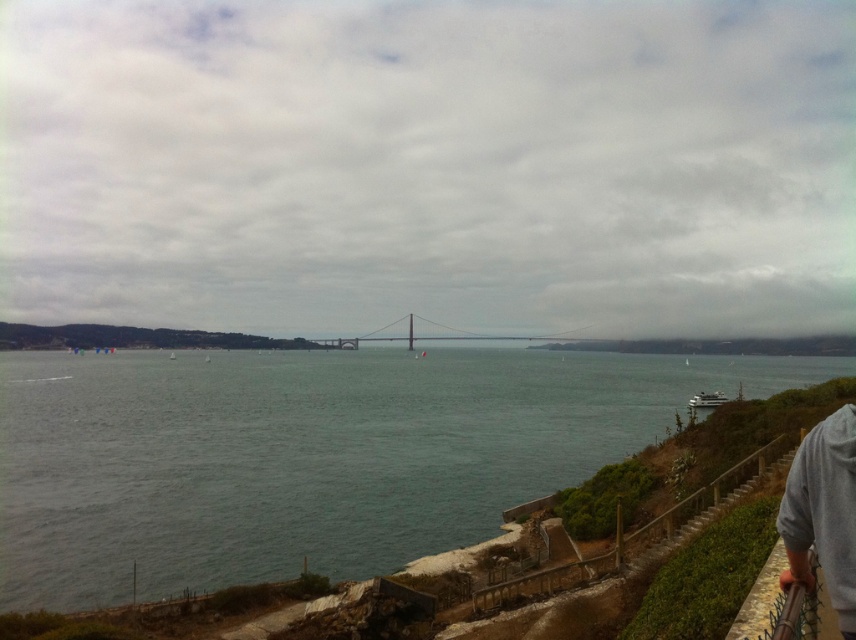
You are standing at the viewpoint overlooking the river and see the gray hoodie at lower right and the metallic gray bridge at center. Which object appears taller in the scene?

The metallic gray bridge at center appears taller than the gray hoodie at lower right because the gray hoodie at lower right is shorter than the metallic gray bridge at center.

You are a photographer wanting to capture the entire view of the metallic gray bridge at center and the greenish water at center in one shot. Based on the scene, which object would require you to adjust your camera angle to ensure both are fully visible?

The greenish water at center might be wider than metallic gray bridge at center, so you may need to adjust your camera angle to include the entire width of the greenish water at center while keeping the metallic gray bridge at center in the frame.